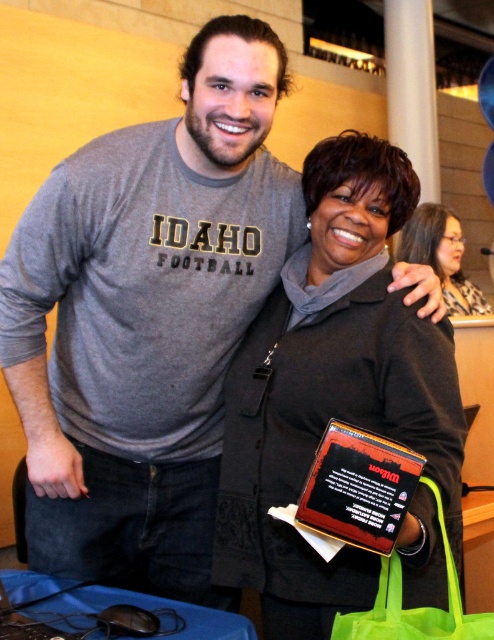
Question: Among these points, which one is farthest from the camera?

Choices:
 (A) (329, 506)
 (B) (441, 214)
 (C) (414, 548)

Answer: (B)

Question: Can you confirm if black plastic plaque at center is bigger than neon green fabric shopping bag at lower right?

Choices:
 (A) no
 (B) yes

Answer: (A)

Question: Which point appears farthest from the camera in this image?

Choices:
 (A) coord(274,618)
 (B) coord(434,256)
 (C) coord(325,432)
 (D) coord(454,614)

Answer: (B)

Question: Can you confirm if matte black jacket at center is positioned to the left of black plastic plaque at center?

Choices:
 (A) yes
 (B) no

Answer: (A)

Question: Does matte black jacket at center have a smaller size compared to black plastic plaque at center?

Choices:
 (A) no
 (B) yes

Answer: (A)

Question: Which is nearer to the black plastic plaque at center?

Choices:
 (A) matte black jacket at center
 (B) neon green fabric shopping bag at lower right

Answer: (B)